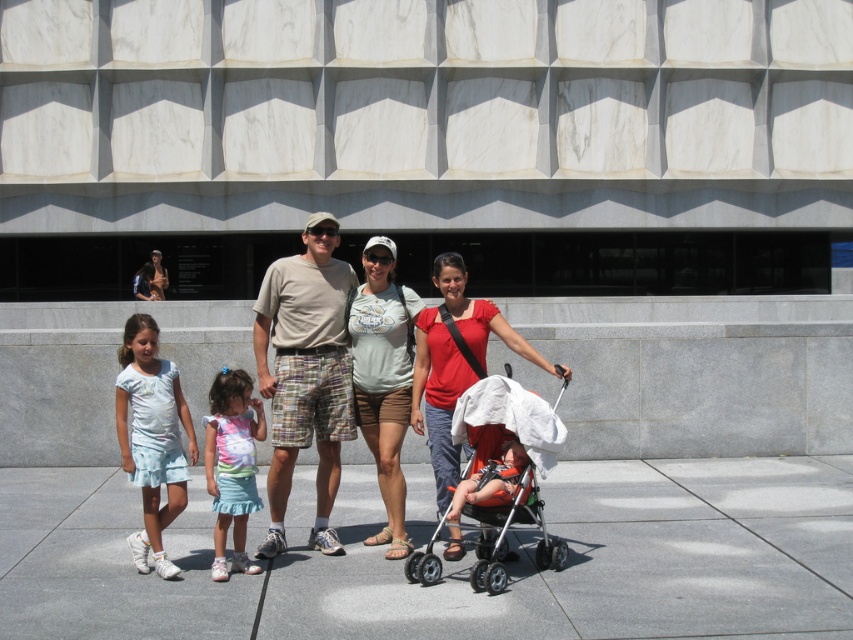
This screenshot has height=640, width=853. Describe the element at coordinates (151, 436) in the screenshot. I see `light blue cotton dress at left` at that location.

You are a GUI agent. You are given a task and a screenshot of the screen. Output one action in this format:
    pyautogui.click(x=<x>, y=<y>)
    Task: Click on the light blue cotton dress at left
    
    Given the screenshot: What is the action you would take?
    pyautogui.click(x=151, y=436)

You are a GUI agent. You are given a task and a screenshot of the screen. Output one action in this format:
    pyautogui.click(x=<x>, y=<y>)
    Task: Click on the light blue cotton dress at left
    This screenshot has width=853, height=640.
    Given the screenshot: What is the action you would take?
    pyautogui.click(x=151, y=436)

Is beige cotton t-shirt at center smaller than orange fabric baby carriage at lower center?

Incorrect, beige cotton t-shirt at center is not smaller in size than orange fabric baby carriage at lower center.

Can you confirm if beige cotton t-shirt at center is wider than orange fabric baby carriage at lower center?

Correct, the width of beige cotton t-shirt at center exceeds that of orange fabric baby carriage at lower center.

Is point (270, 481) farther from viewer compared to point (512, 456)?

Yes, it is.

At what (x,y) coordinates should I click in order to perform the action: click on beige cotton t-shirt at center. Please return your answer as a coordinate pair (x, y). Looking at the image, I should click on (305, 372).

Is gray concrete pavement at center positioned in front of matte gray t-shirt at center?

That is True.

Which is more to the left, gray concrete pavement at center or matte gray t-shirt at center?

From the viewer's perspective, matte gray t-shirt at center appears more on the left side.

Describe the element at coordinates (454, 563) in the screenshot. This screenshot has height=640, width=853. I see `gray concrete pavement at center` at that location.

Identify the location of gray concrete pavement at center. This screenshot has width=853, height=640. (454, 563).